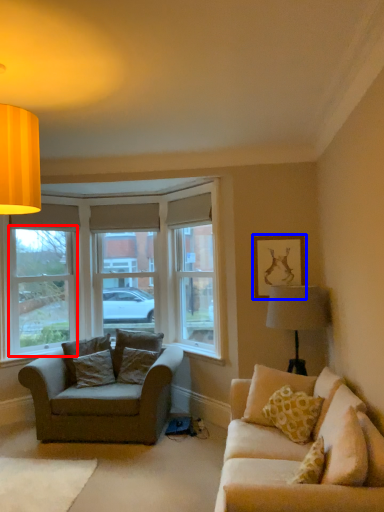
Question: Which object is closer to the camera taking this photo, window frame (highlighted by a red box) or picture frame (highlighted by a blue box)?

Choices:
 (A) window frame
 (B) picture frame

Answer: (B)